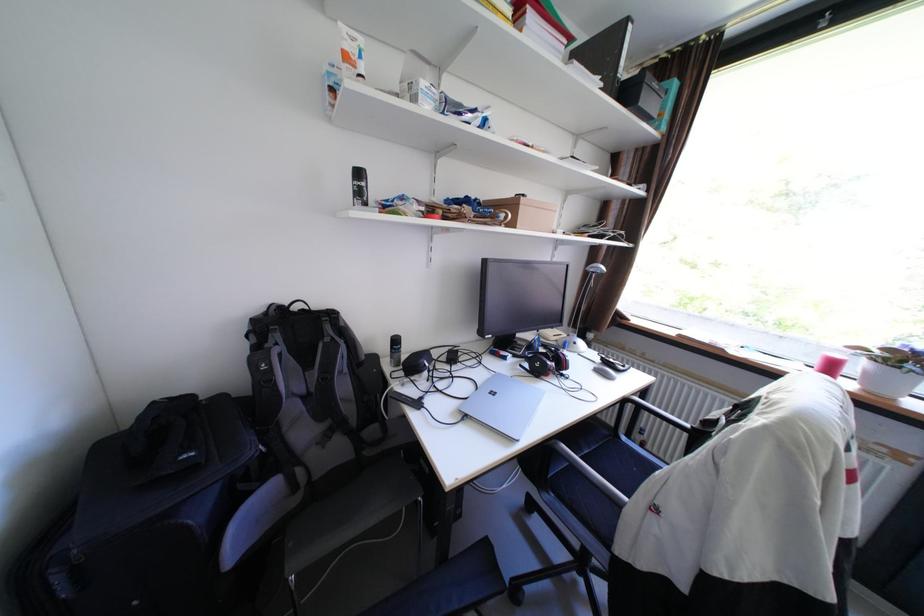
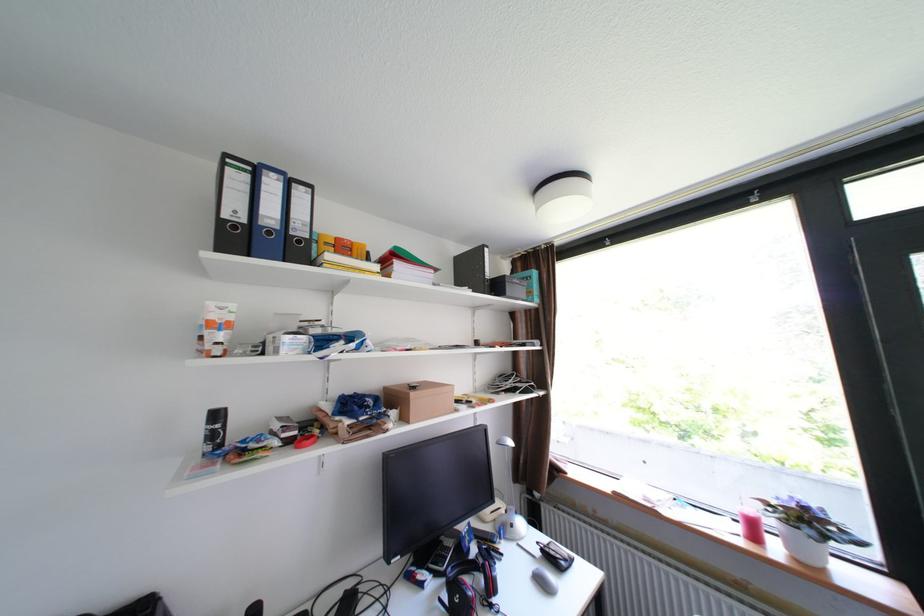
Where in the second image is the point corresponding to (x=869, y=363) from the first image?

(782, 523)